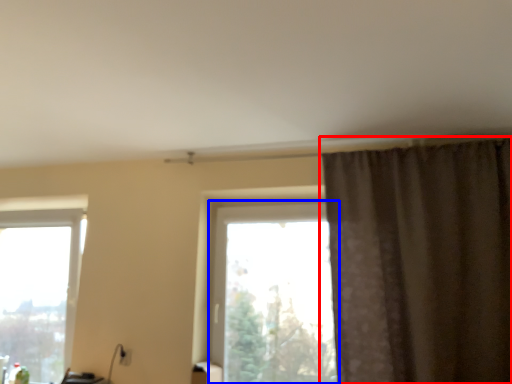
Question: Among these objects, which one is farthest to the camera, curtain (highlighted by a red box) or window (highlighted by a blue box)?

Choices:
 (A) curtain
 (B) window

Answer: (B)